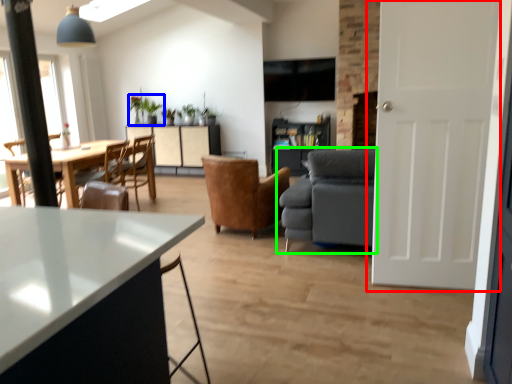
Question: Considering the real-world distances, which object is closest to door (highlighted by a red box)? houseplant (highlighted by a blue box) or studio couch (highlighted by a green box).

Choices:
 (A) houseplant
 (B) studio couch

Answer: (B)